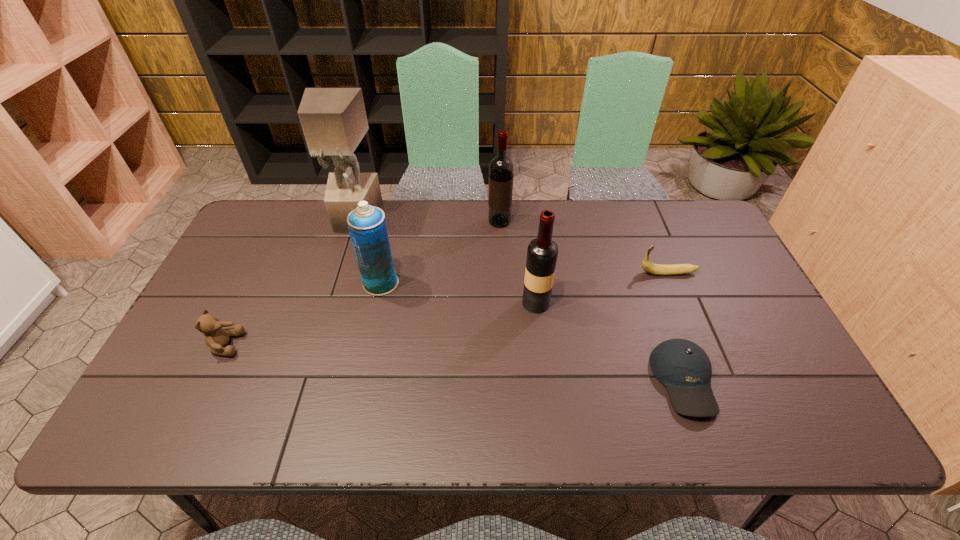
Locate an element on the screen. This screenshot has height=540, width=960. object that is at the left edge is located at coordinates (216, 338).

In order to click on object present at the right edge in this screenshot , I will do [656, 269].

Where is `vacant space at the far edge of the desktop`? vacant space at the far edge of the desktop is located at coordinates (641, 245).

At what (x,y) coordinates should I click in order to perform the action: click on free spot at the near edge of the desktop. Please return your answer as a coordinate pair (x, y). Looking at the image, I should click on (361, 416).

Where is `free region at the left edge`? This screenshot has height=540, width=960. free region at the left edge is located at coordinates (252, 262).

In the image, there is a desktop. Identify the location of vacant space at the right edge. Image resolution: width=960 pixels, height=540 pixels. (729, 295).

This screenshot has width=960, height=540. I want to click on vacant space at the far left corner of the desktop, so click(291, 233).

Where is `vacant region at the far right corner of the desktop`? The image size is (960, 540). vacant region at the far right corner of the desktop is located at coordinates (673, 209).

Find the location of a particular element. The height and width of the screenshot is (540, 960). unoccupied position between the right wine bottle and the banana is located at coordinates (602, 288).

Image resolution: width=960 pixels, height=540 pixels. Identify the location of vacant area between the banana and the tallest object. (512, 246).